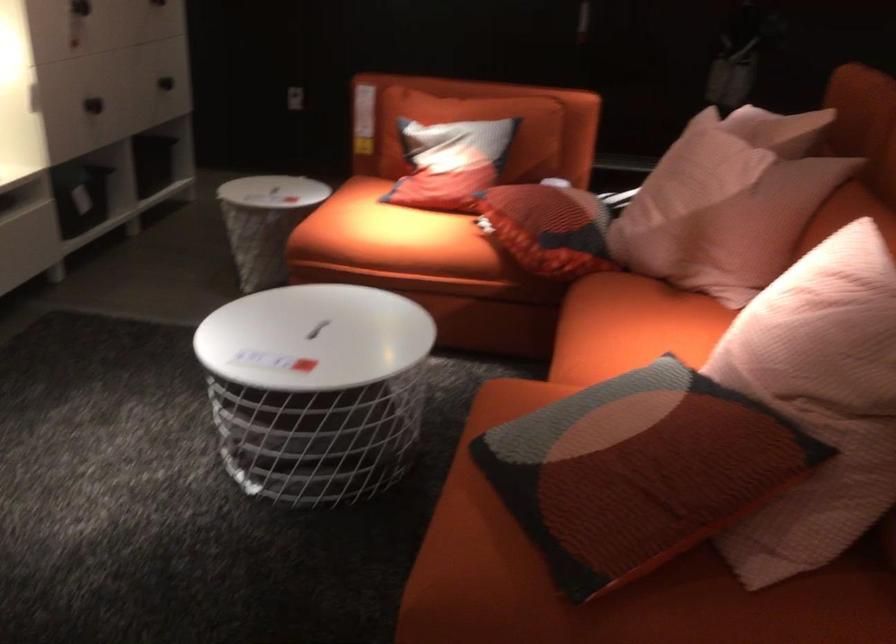
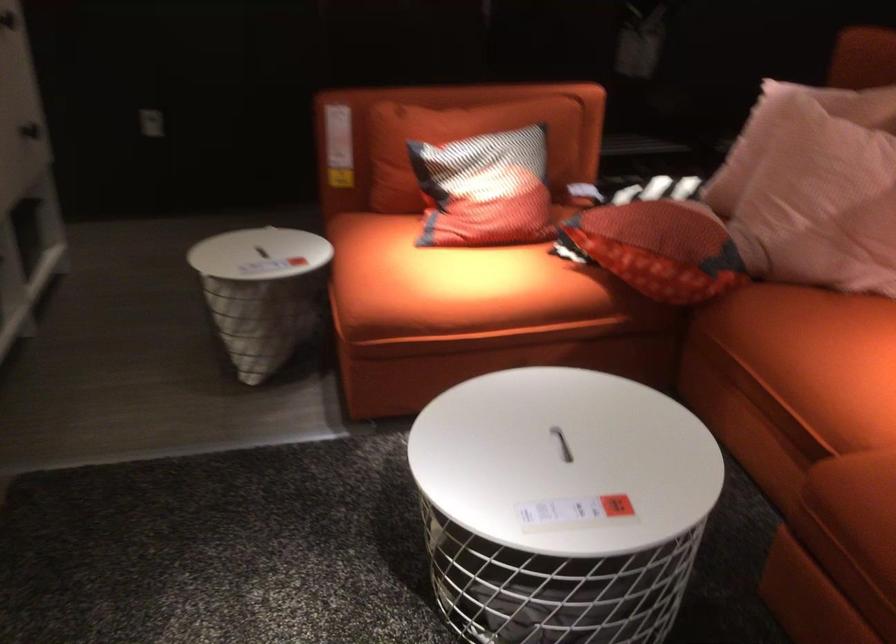
Where in the second image is the point corresponding to [380,230] from the first image?

(449, 281)